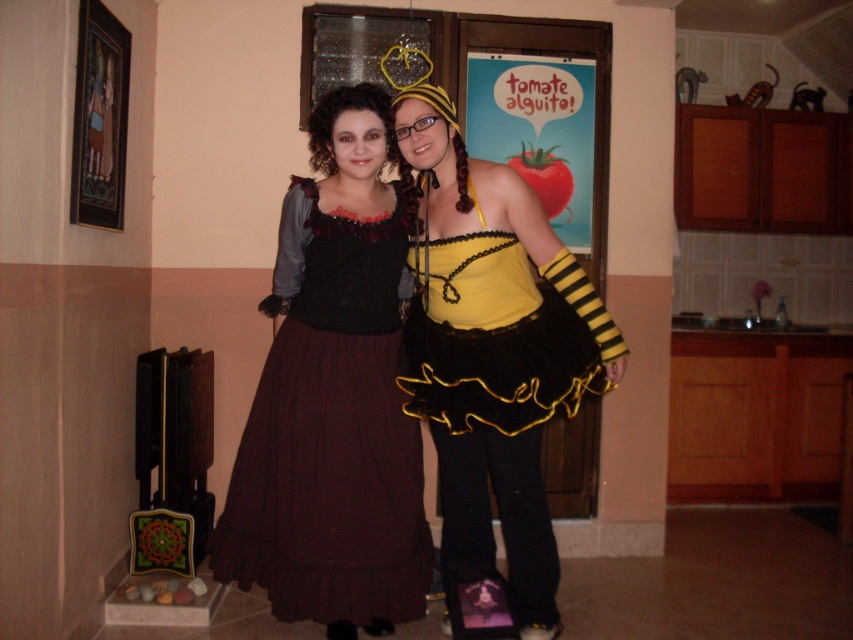
You are a photographer setting up a shoot in a kitchen. You need to position two models wearing the matte black dress at center and dark red satin dress at center so that both are visible in the frame. Given their height difference, which dress should be placed closer to the front to ensure both are visible?

The matte black dress at center is much taller than the dark red satin dress at center, so the dark red satin dress at center should be placed closer to the front to ensure both are visible in the frame.

You are a photographer setting up a photoshoot in a kitchen area. You have two dresses at center, the matte black dress at center and the dark red satin dress at center. Which dress should you focus on to ensure it appears in the foreground of your photo?

The matte black dress at center is in front of the dark red satin dress at center, so focusing on the matte black dress at center will ensure it appears in the foreground.